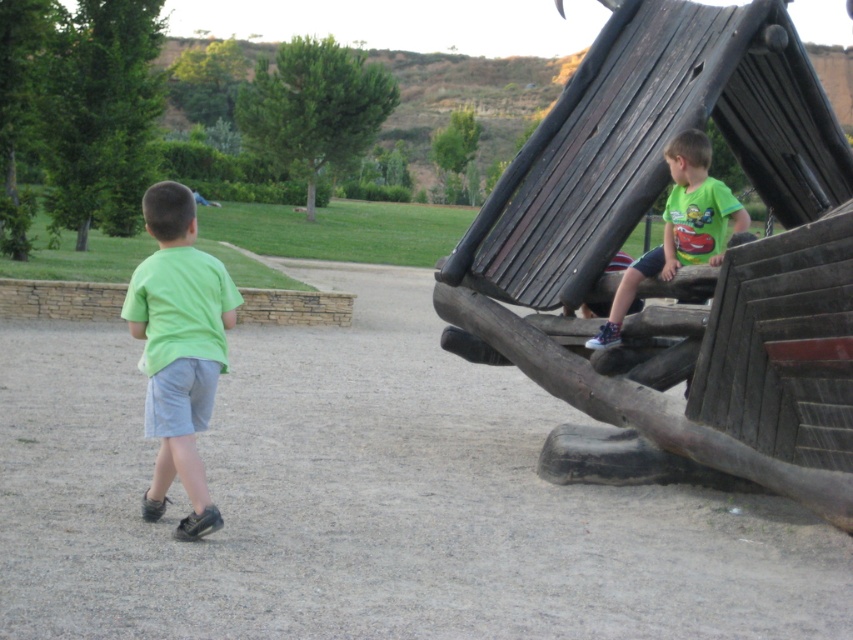
Can you confirm if wooden ship at right is bigger than green matte shirt at left?

Indeed, wooden ship at right has a larger size compared to green matte shirt at left.

Looking at this image, does wooden ship at right appear on the left side of green matte shirt at left?

No, wooden ship at right is not to the left of green matte shirt at left.

You are a GUI agent. You are given a task and a screenshot of the screen. Output one action in this format:
    pyautogui.click(x=<x>, y=<y>)
    Task: Click on the wooden ship at right
    The width and height of the screenshot is (853, 640).
    Given the screenshot: What is the action you would take?
    pyautogui.click(x=683, y=269)

Is point (611, 150) closer to camera compared to point (705, 225)?

No, it is not.

Is wooden ship at right above green matte shirt at upper right?

Yes, wooden ship at right is above green matte shirt at upper right.

Find the location of a particular element. The image size is (853, 640). wooden ship at right is located at coordinates (683, 269).

What do you see at coordinates (178, 348) in the screenshot? I see `green matte shirt at left` at bounding box center [178, 348].

Identify the location of green matte shirt at left. The image size is (853, 640). (178, 348).